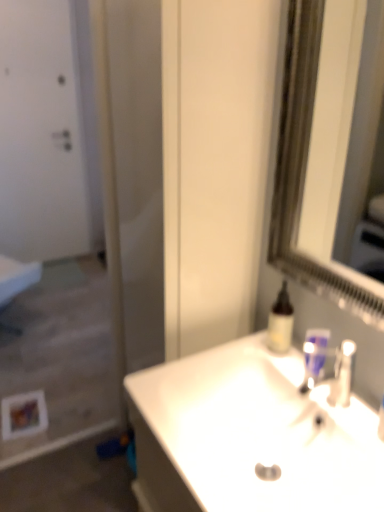
Find the location of a particular element. vacant space situated on the left part of translucent plastic bottle at upper right, acting as the 2th mouthwash starting from the right is located at coordinates (240, 348).